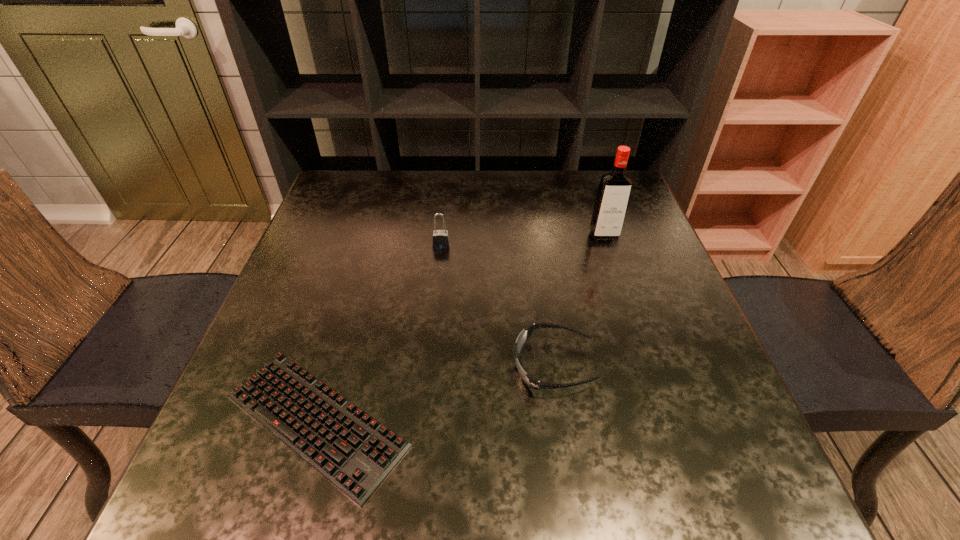
In order to click on free space located on the lenses of the sunglasses in this screenshot , I will do `click(353, 365)`.

Identify the location of vacant space located on the lenses of the sunglasses. Image resolution: width=960 pixels, height=540 pixels. (438, 365).

Identify the location of free space located 0.200m on the back of the shortest object. This screenshot has height=540, width=960. (357, 283).

You are a GUI agent. You are given a task and a screenshot of the screen. Output one action in this format:
    pyautogui.click(x=<x>, y=<y>)
    Task: Click on the object that is at the near edge
    The height and width of the screenshot is (540, 960).
    Given the screenshot: What is the action you would take?
    pyautogui.click(x=351, y=449)

The width and height of the screenshot is (960, 540). I want to click on object present at the left edge, so click(x=351, y=449).

Locate an element on the screen. This screenshot has height=540, width=960. object at the right edge is located at coordinates (615, 186).

At what (x,y) coordinates should I click in order to perform the action: click on object at the near left corner. Please return your answer as a coordinate pair (x, y). Looking at the image, I should click on (351, 449).

Image resolution: width=960 pixels, height=540 pixels. I want to click on free space at the far edge of the desktop, so click(501, 183).

Identify the location of vacant space at the near edge. (303, 481).

The image size is (960, 540). Find the location of `vacant space at the left edge of the desktop`. vacant space at the left edge of the desktop is located at coordinates (276, 299).